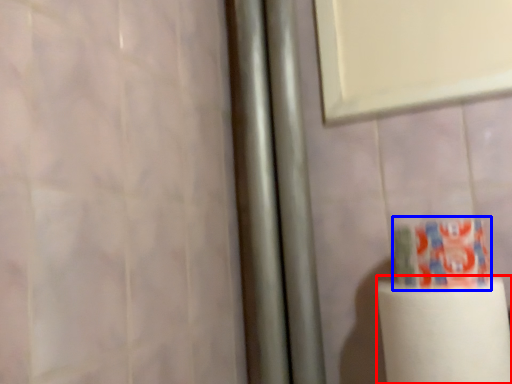
Question: Which point is further to the camera, paper towel (highlighted by a red box) or toothpaste (highlighted by a blue box)?

Choices:
 (A) paper towel
 (B) toothpaste

Answer: (B)